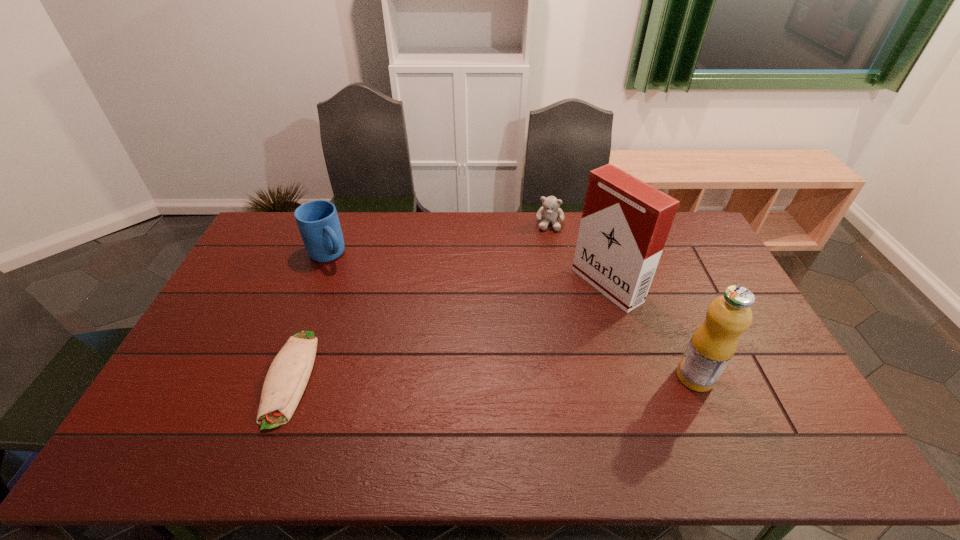
The height and width of the screenshot is (540, 960). What are the coordinates of `unoccupied position between the third shortest object and the cigarette_case` in the screenshot? It's located at (468, 270).

Find the location of a particular element. The height and width of the screenshot is (540, 960). empty space between the burrito and the third tallest object is located at coordinates (309, 316).

The height and width of the screenshot is (540, 960). I want to click on vacant area between the burrito and the teddy bear, so click(420, 300).

Identify the location of unoccupied position between the fruit juice and the burrito. This screenshot has width=960, height=540. (492, 377).

Identify the location of vacant area that lies between the shortest object and the fruit juice. (492, 377).

Identify the location of free point between the third tallest object and the second tallest object. (512, 316).

This screenshot has width=960, height=540. Identify the location of vacant space in between the cigarette_case and the third tallest object. (468, 270).

Identify which object is the fourth nearest to the cigarette_case. Please provide its 2D coordinates. Your answer should be formatted as a tuple, i.e. [(x, y)], where the tuple contains the x and y coordinates of a point satisfying the conditions above.

[(318, 222)]

Identify which object is located as the nearest to the farthest object. Please provide its 2D coordinates. Your answer should be formatted as a tuple, i.e. [(x, y)], where the tuple contains the x and y coordinates of a point satisfying the conditions above.

[(625, 222)]

Identify the location of free region that satisfies the following two spatial constraints: 1. on the front side of the tallest object; 2. on the front label of the second tallest object. The image size is (960, 540). (635, 377).